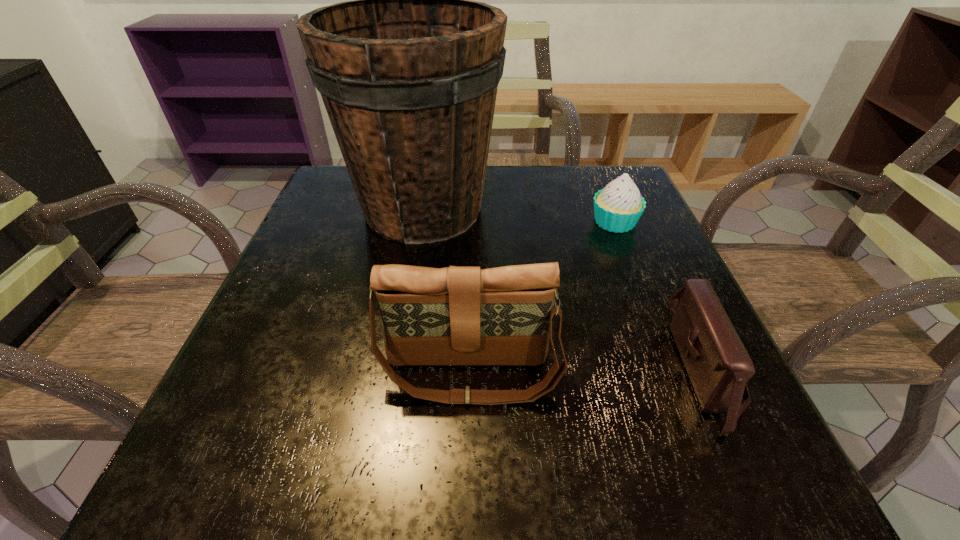
Find the location of `vacant space located on the front flap of the right shoulder bag`. vacant space located on the front flap of the right shoulder bag is located at coordinates (612, 369).

Image resolution: width=960 pixels, height=540 pixels. What are the coordinates of `bucket that is at the far edge` in the screenshot? It's located at (408, 72).

Find the location of a particular element. The height and width of the screenshot is (540, 960). cupcake situated at the far edge is located at coordinates (617, 208).

Find the location of a particular element. This screenshot has height=540, width=960. object that is at the near edge is located at coordinates (718, 365).

Locate an element on the screen. object at the left edge is located at coordinates (408, 72).

You are a GUI agent. You are given a task and a screenshot of the screen. Output one action in this format:
    pyautogui.click(x=<x>, y=<y>)
    Task: Click on the cupcake present at the right edge
    This screenshot has height=540, width=960.
    Given the screenshot: What is the action you would take?
    pyautogui.click(x=617, y=208)

Where is `shoulder bag situated at the right edge`? shoulder bag situated at the right edge is located at coordinates pyautogui.click(x=718, y=365).

Image resolution: width=960 pixels, height=540 pixels. I want to click on object situated at the far left corner, so click(x=408, y=72).

Where is `object at the far right corner`? object at the far right corner is located at coordinates (617, 208).

You are a GUI agent. You are given a task and a screenshot of the screen. Output one action in this format:
    pyautogui.click(x=<x>, y=<y>)
    Task: Click on the object positioned at the near right corner
    The image size is (960, 540).
    Given the screenshot: What is the action you would take?
    pyautogui.click(x=718, y=365)